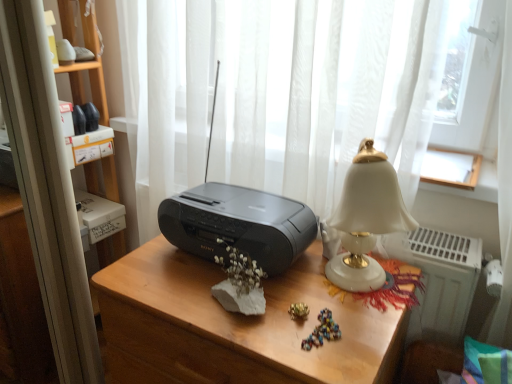
This screenshot has width=512, height=384. Find the location of `free location above black plastic printer at center (from a real-world perspective)`. free location above black plastic printer at center (from a real-world perspective) is located at coordinates (215, 203).